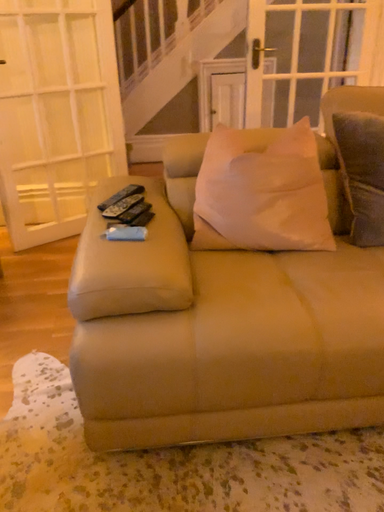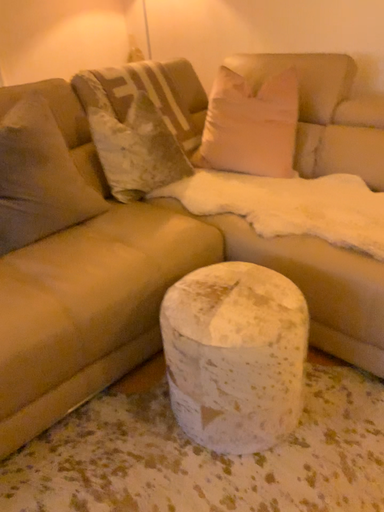
Question: How did the camera likely rotate when shooting the video?

Choices:
 (A) rotated left
 (B) rotated right

Answer: (B)